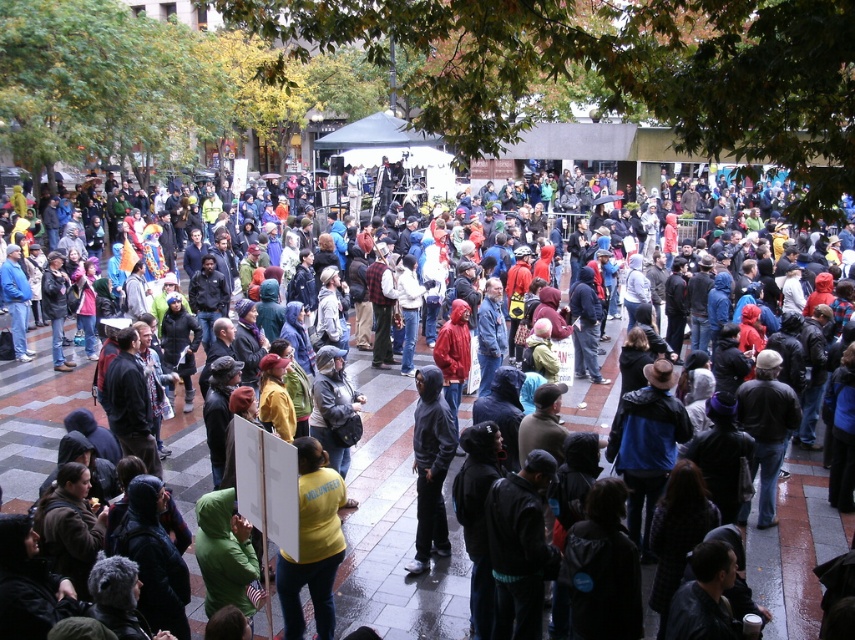
Question: Is yellow hoodie at center behind yellow matte shirt at center?

Choices:
 (A) no
 (B) yes

Answer: (B)

Question: Which object is farther from the camera taking this photo?

Choices:
 (A) dark gray hoodie at center
 (B) yellow matte shirt at center

Answer: (A)

Question: Which object is the farthest from the yellow matte shirt at center?

Choices:
 (A) dark gray hoodie at center
 (B) yellow hoodie at center

Answer: (B)

Question: Does yellow hoodie at center appear on the right side of dark gray hoodie at center?

Choices:
 (A) yes
 (B) no

Answer: (B)

Question: Does yellow matte shirt at center appear on the right side of dark gray hoodie at center?

Choices:
 (A) yes
 (B) no

Answer: (B)

Question: Considering the real-world distances, which object is farthest from the yellow hoodie at center?

Choices:
 (A) dark gray hoodie at center
 (B) yellow matte shirt at center

Answer: (A)